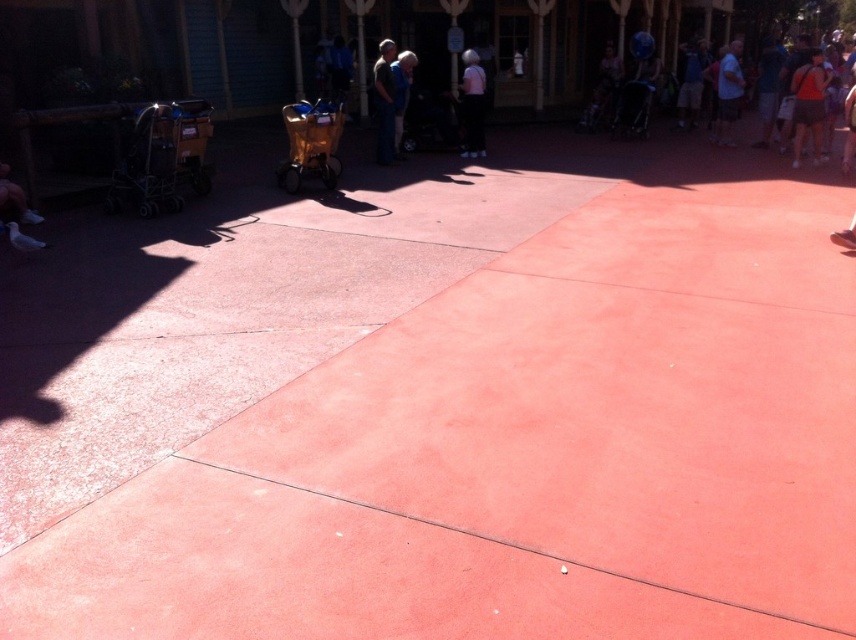
Question: Which object is the closest to the gold metallic stroller at center?

Choices:
 (A) metallic silver cart at left
 (B) dark blue shirt at center

Answer: (A)

Question: Does dark blue shirt at center appear under matte black stroller at center?

Choices:
 (A) no
 (B) yes

Answer: (B)

Question: Which object is closer to the camera taking this photo?

Choices:
 (A) white cotton shirt at upper right
 (B) metallic silver cart at left

Answer: (B)

Question: Can you confirm if white cotton shirt at upper right is positioned above matte black stroller at center?

Choices:
 (A) yes
 (B) no

Answer: (A)

Question: Which point is closer to the camera?

Choices:
 (A) (379, 80)
 (B) (819, 160)

Answer: (A)

Question: Is metallic silver cart at left further to camera compared to gold metallic stroller at center?

Choices:
 (A) yes
 (B) no

Answer: (B)